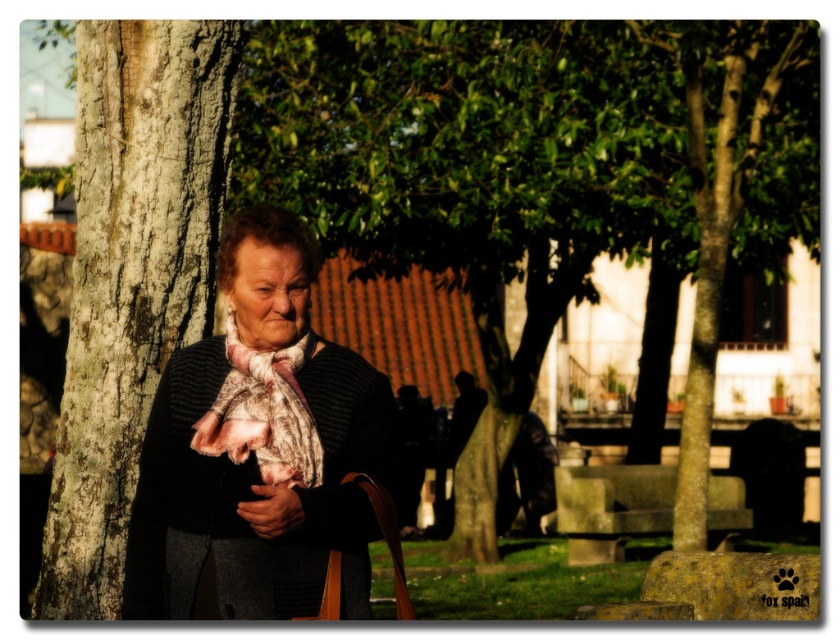
Who is shorter, dark blue jeans at lower right or smooth brown leather handbag at lower center?

Standing shorter between the two is smooth brown leather handbag at lower center.

Is dark blue jeans at lower right above smooth brown leather handbag at lower center?

Actually, dark blue jeans at lower right is below smooth brown leather handbag at lower center.

Who is more forward, [539,502] or [261,515]?

Positioned in front is point [261,515].

Identify the location of dark blue jeans at lower right. (528, 477).

Between matte black sweater at center and smooth bark tree trunk at left, which one is positioned lower?

matte black sweater at center

Is point (297, 451) positioned before point (150, 340)?

That is True.

Describe the element at coordinates (260, 445) in the screenshot. The height and width of the screenshot is (640, 840). I see `matte black sweater at center` at that location.

In order to click on matte black sweater at center in this screenshot , I will do `click(260, 445)`.

Does matte black sweater at center have a larger size compared to dark blue jeans at lower right?

Incorrect, matte black sweater at center is not larger than dark blue jeans at lower right.

Is matte black sweater at center thinner than dark blue jeans at lower right?

No.

Is point (277, 262) positioned in front of point (554, 497)?

That is True.

Where is `matte black sweater at center`? This screenshot has width=840, height=640. matte black sweater at center is located at coordinates (260, 445).